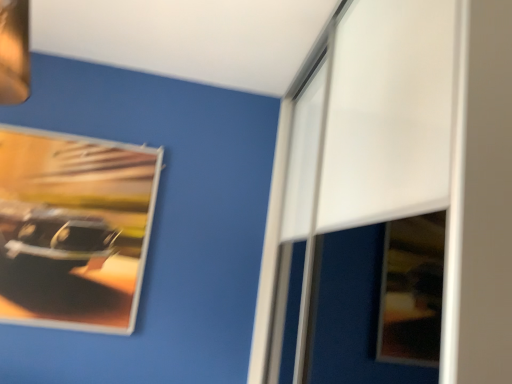
This screenshot has height=384, width=512. I want to click on metallic reflective poster at upper left, so click(74, 229).

Describe the element at coordinates (74, 229) in the screenshot. I see `metallic reflective poster at upper left` at that location.

Identify the location of metallic reflective poster at upper left. (74, 229).